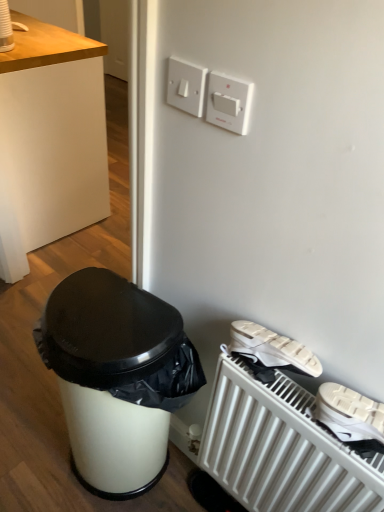
Measure the distance between point (x=70, y=133) and camera.

A distance of 1.98 meters exists between point (x=70, y=133) and camera.

Locate an element on the screen. This screenshot has height=512, width=384. white plastic switch at upper center is located at coordinates (186, 86).

Considering the points (182, 66) and (102, 400), which point is in front, point (182, 66) or point (102, 400)?

The point (182, 66) is closer.

Which is more to the left, white plastic switch at upper center or white glossy trash can at lower left?

white glossy trash can at lower left.

Consider the image. Which object is further away from the camera, white plastic switch at upper center or white glossy trash can at lower left?

white glossy trash can at lower left is further from the camera.

Between white matte radiator at lower right and white plastic light switch at upper center, which one has smaller width?

With smaller width is white plastic light switch at upper center.

Considering the sizes of objects white matte radiator at lower right and white plastic light switch at upper center in the image provided, who is smaller, white matte radiator at lower right or white plastic light switch at upper center?

white plastic light switch at upper center.

Is white matte radiator at lower right next to white plastic light switch at upper center and touching it?

They are not placed beside each other.

Consider the image. Is white matte radiator at lower right at the right side of white plastic light switch at upper center?

Yes, white matte radiator at lower right is to the right of white plastic light switch at upper center.

Visually, is white matte radiator at lower right positioned to the left or to the right of white wood desk at upper left?

Based on their positions, white matte radiator at lower right is located to the right of white wood desk at upper left.

From a real-world perspective, relative to white wood desk at upper left, is white matte radiator at lower right vertically above or below?

Clearly, from a real-world perspective, white matte radiator at lower right is below white wood desk at upper left.

Can you tell me how much white matte radiator at lower right and white wood desk at upper left differ in facing direction?

176 degrees.

Is white matte radiator at lower right oriented towards white wood desk at upper left?

No, white matte radiator at lower right is not turned towards white wood desk at upper left.

Considering the sizes of objects white plastic light switch at upper center and white matte radiator at lower right in the image provided, who is smaller, white plastic light switch at upper center or white matte radiator at lower right?

Smaller between the two is white plastic light switch at upper center.

Consider the image. From a real-world perspective, which object rests below the other?

white matte radiator at lower right.

Is white plastic light switch at upper center far away from white matte radiator at lower right?

No.

Locate an element on the screen. The image size is (384, 512). light switch in front of the white matte radiator at lower right is located at coordinates (229, 102).

Is white plastic switch at upper center positioned far away from white wood desk at upper left?

Yes, white plastic switch at upper center and white wood desk at upper left are located far from each other.

Is white plastic switch at upper center smaller than white wood desk at upper left?

Indeed, white plastic switch at upper center has a smaller size compared to white wood desk at upper left.

Would you say white plastic switch at upper center contains white wood desk at upper left?

No, white wood desk at upper left is located outside of white plastic switch at upper center.

Considering the positions of objects white plastic switch at upper center and white wood desk at upper left in the image provided, who is more to the right, white plastic switch at upper center or white wood desk at upper left?

white plastic switch at upper center.

Could you tell me if white wood desk at upper left is facing white plastic light switch at upper center?

No, white wood desk at upper left does not turn towards white plastic light switch at upper center.

Which object is wider, white wood desk at upper left or white plastic light switch at upper center?

With larger width is white wood desk at upper left.

Image resolution: width=384 pixels, height=512 pixels. Identify the location of light switch below the white wood desk at upper left (from the image's perspective). [229, 102].

From a real-world perspective, is white wood desk at upper left located higher than white plastic light switch at upper center?

Incorrect, from a real-world perspective, white wood desk at upper left is lower than white plastic light switch at upper center.

From the image's perspective, which one is positioned higher, white glossy trash can at lower left or white plastic light switch at upper center?

white plastic light switch at upper center is shown above in the image.

Is white glossy trash can at lower left directly adjacent to white plastic light switch at upper center?

white glossy trash can at lower left is not next to white plastic light switch at upper center, and they're not touching.

Which object is closer to the camera taking this photo, white glossy trash can at lower left or white plastic light switch at upper center?

white plastic light switch at upper center is more forward.

Which object is wider, white glossy trash can at lower left or white plastic light switch at upper center?

white glossy trash can at lower left is wider.

You are a GUI agent. You are given a task and a screenshot of the screen. Output one action in this format:
    pyautogui.click(x=<x>, y=<y>)
    Task: Click on the electric outlet in front of the white glossy trash can at lower left
    The height and width of the screenshot is (512, 384).
    Given the screenshot: What is the action you would take?
    pyautogui.click(x=186, y=86)

Image resolution: width=384 pixels, height=512 pixels. I want to click on radiator on the right of the white plastic light switch at upper center, so click(x=281, y=448).

When comparing their distances from white plastic light switch at upper center, does white glossy trash can at lower left or white plastic switch at upper center seem closer?

white plastic switch at upper center lies closer to white plastic light switch at upper center than the other object.

Looking at the image, which one is located closer to white matte radiator at lower right, white plastic light switch at upper center or white wood desk at upper left?

The object closer to white matte radiator at lower right is white plastic light switch at upper center.

From the image, which object appears to be nearer to white wood desk at upper left, white matte radiator at lower right or white plastic switch at upper center?

Among the two, white plastic switch at upper center is located nearer to white wood desk at upper left.

When comparing their distances from white wood desk at upper left, does white glossy trash can at lower left or white matte radiator at lower right seem closer?

white glossy trash can at lower left is positioned closer to the anchor white wood desk at upper left.

Which object lies nearer to the anchor point white wood desk at upper left, white plastic light switch at upper center or white glossy trash can at lower left?

white glossy trash can at lower left is positioned closer to the anchor white wood desk at upper left.

Which object lies further to the anchor point white plastic switch at upper center, white plastic light switch at upper center or white matte radiator at lower right?

Based on the image, white matte radiator at lower right appears to be further to white plastic switch at upper center.

Considering their positions, is white plastic switch at upper center positioned further to white plastic light switch at upper center than white wood desk at upper left?

Among the two, white wood desk at upper left is located further to white plastic light switch at upper center.

From the image, which object appears to be farther from white glossy trash can at lower left, white plastic light switch at upper center or white plastic switch at upper center?

white plastic light switch at upper center is further to white glossy trash can at lower left.

Where is `light switch between white plastic switch at upper center and white matte radiator at lower right from top to bottom`? The image size is (384, 512). light switch between white plastic switch at upper center and white matte radiator at lower right from top to bottom is located at coordinates (229, 102).

Identify the location of electric outlet that lies between white wood desk at upper left and white matte radiator at lower right from top to bottom. (186, 86).

You are a GUI agent. You are given a task and a screenshot of the screen. Output one action in this format:
    pyautogui.click(x=<x>, y=<y>)
    Task: Click on the radiator that lies between white wood desk at upper left and white glossy trash can at lower left from top to bottom
    This screenshot has width=384, height=512.
    Given the screenshot: What is the action you would take?
    pyautogui.click(x=281, y=448)

Identify the location of light switch between white plastic switch at upper center and white glossy trash can at lower left in the vertical direction. This screenshot has width=384, height=512. (229, 102).